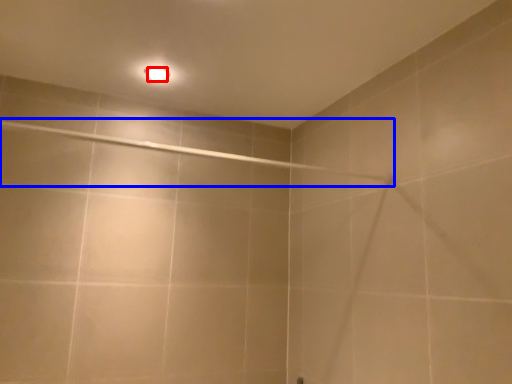
Question: Among these objects, which one is nearest to the camera, light bulb (highlighted by a red box) or shower (highlighted by a blue box)?

Choices:
 (A) light bulb
 (B) shower

Answer: (B)